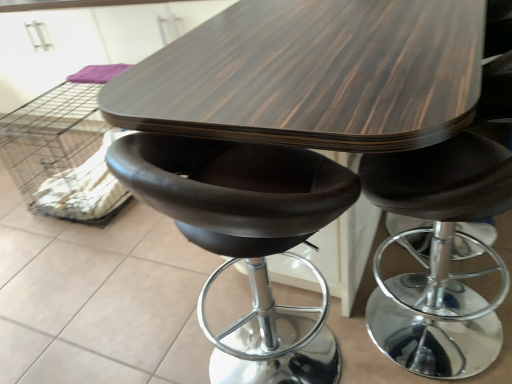
This screenshot has height=384, width=512. Find the location of `free space above dark wood table at center (from a real-world perspective)`. free space above dark wood table at center (from a real-world perspective) is located at coordinates (310, 38).